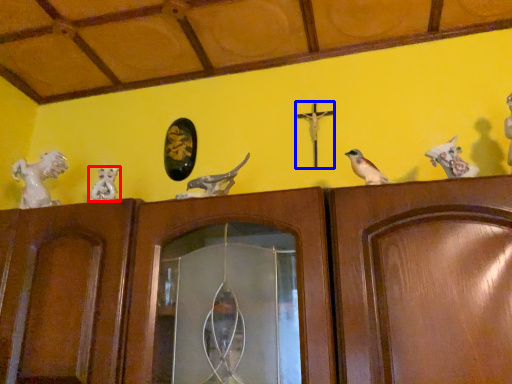
Question: Which of the following is the farthest to the observer, animal (highlighted by a red box) or crucifix (highlighted by a blue box)?

Choices:
 (A) animal
 (B) crucifix

Answer: (B)